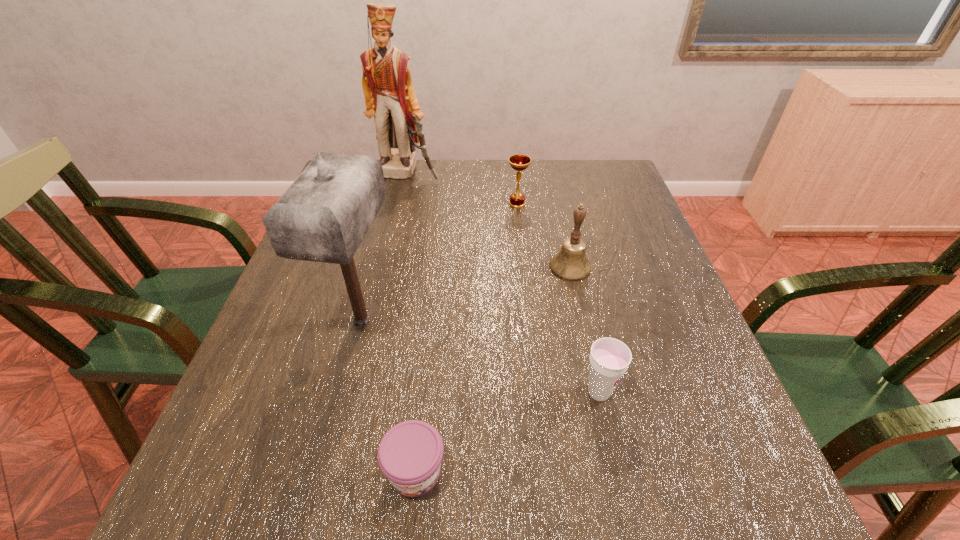
Where is `nutcracker that is at the left edge`? nutcracker that is at the left edge is located at coordinates (389, 94).

Where is `mallet positioned at the left edge`? The image size is (960, 540). mallet positioned at the left edge is located at coordinates (323, 216).

Where is `object present at the far left corner`? This screenshot has width=960, height=540. object present at the far left corner is located at coordinates (389, 94).

You are a GUI agent. You are given a task and a screenshot of the screen. Output one action in this format:
    pyautogui.click(x=<x>, y=<y>)
    Task: Click on the vacant region at the far edge
    This screenshot has width=960, height=540.
    Given the screenshot: What is the action you would take?
    pyautogui.click(x=511, y=168)

At what (x,y) coordinates should I click in order to perform the action: click on free space at the near edge. Please return your answer as a coordinate pair (x, y). The image size is (960, 540). Looking at the image, I should click on (544, 477).

You are a GUI agent. You are given a task and a screenshot of the screen. Output one action in this format:
    pyautogui.click(x=<x>, y=<y>)
    Task: Click on the free region at the left edge
    
    Given the screenshot: What is the action you would take?
    pyautogui.click(x=292, y=365)

In the image, there is a desktop. Where is `vacant space at the right edge`? This screenshot has width=960, height=540. vacant space at the right edge is located at coordinates point(725,449).

At what (x,y) coordinates should I click in order to perform the action: click on free space at the far right corner. Please return your answer as a coordinate pair (x, y). Looking at the image, I should click on (609, 188).

Where is `free space between the nearest object and the second nearest object`? free space between the nearest object and the second nearest object is located at coordinates (507, 432).

The image size is (960, 540). I want to click on free space that is in between the chalice and the fifth tallest object, so click(x=558, y=298).